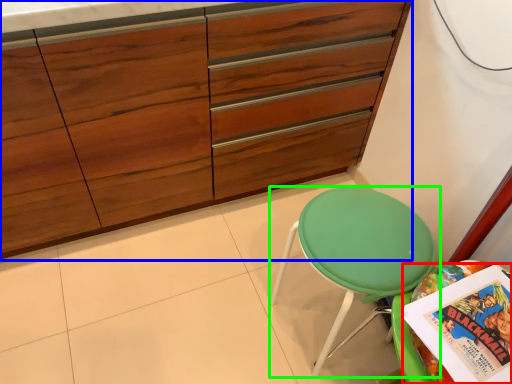
Question: Estimate the real-world distances between objects in this image. Which object is closer to comic book (highlighted by a red box), cabinetry (highlighted by a blue box) or chair (highlighted by a green box)?

Choices:
 (A) cabinetry
 (B) chair

Answer: (B)